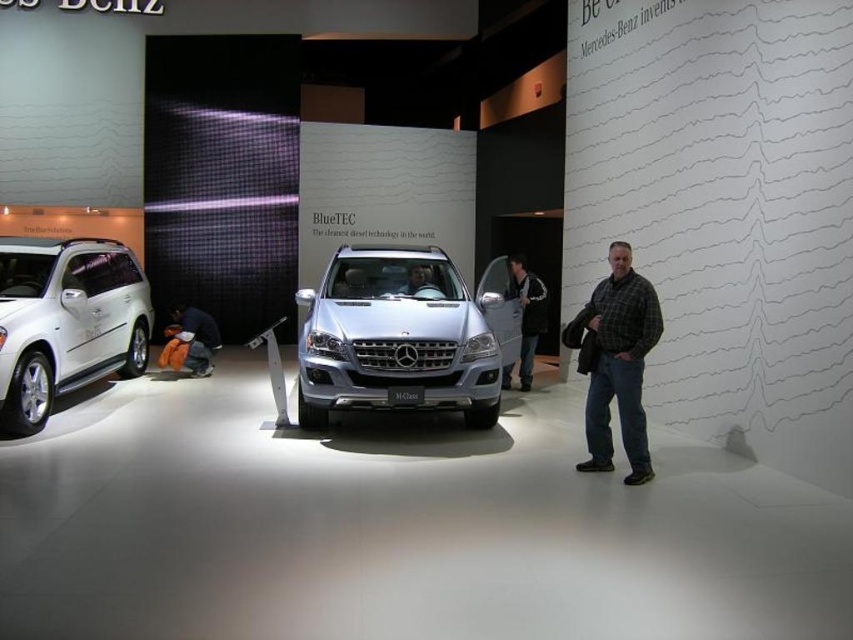
In the scene shown: Does satin silver suv at center appear under plaid shirt at right?

Incorrect, satin silver suv at center is not positioned below plaid shirt at right.

Can you confirm if satin silver suv at center is shorter than plaid shirt at right?

No.

This screenshot has height=640, width=853. What do you see at coordinates (396, 337) in the screenshot?
I see `satin silver suv at center` at bounding box center [396, 337].

The width and height of the screenshot is (853, 640). Find the location of `satin silver suv at center`. satin silver suv at center is located at coordinates (396, 337).

Is white matte suv at left closer to camera compared to plaid shirt at right?

No, white matte suv at left is further to the viewer.

Is white matte suv at left taller than plaid shirt at right?

Yes, white matte suv at left is taller than plaid shirt at right.

Between point (25, 365) and point (651, 316), which one is positioned in front?

Point (651, 316) is in front.

You are a GUI agent. You are given a task and a screenshot of the screen. Output one action in this format:
    pyautogui.click(x=<x>, y=<y>)
    Task: Click on the white matte suv at left
    Image resolution: width=853 pixels, height=640 pixels.
    Given the screenshot: What is the action you would take?
    pyautogui.click(x=67, y=321)

Is satin silver suv at center closer to camera compared to white matte suv at left?

No, satin silver suv at center is further to the viewer.

Is point (306, 417) closer to viewer compared to point (13, 294)?

That is True.

Between point (398, 342) and point (10, 317), which one is positioned behind?

Positioned behind is point (398, 342).

In order to click on satin silver suv at center in this screenshot , I will do [x=396, y=337].